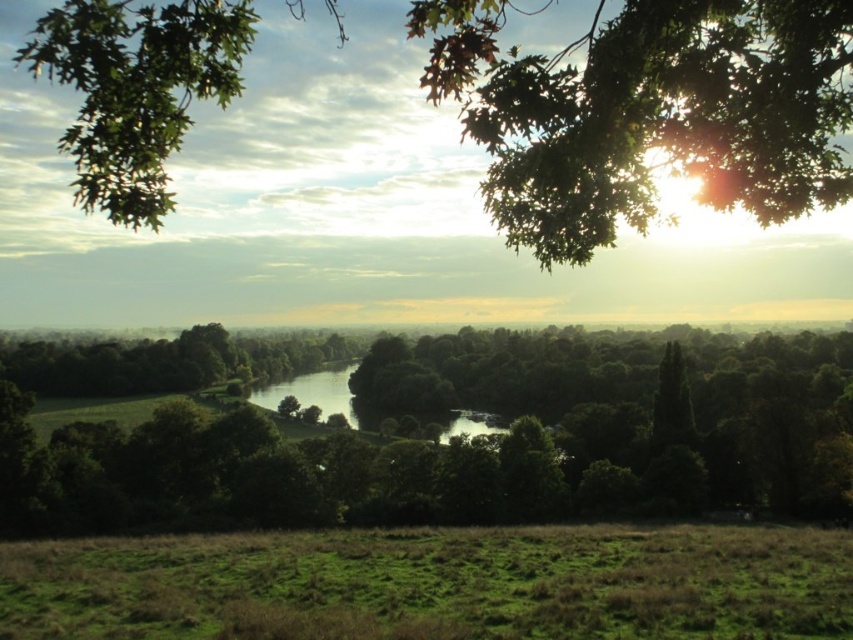
Is green leafy tree at upper center positioned before green grassy field at lower center?

Yes, it is in front of green grassy field at lower center.

Is green leafy tree at upper center bigger than green grassy field at lower center?

Yes, green leafy tree at upper center is bigger than green grassy field at lower center.

Who is more forward, (x=840, y=108) or (x=640, y=628)?

Point (x=840, y=108) is in front.

The height and width of the screenshot is (640, 853). In order to click on green leafy tree at upper center in this screenshot , I will do `click(647, 113)`.

Between point (613, 349) and point (698, 624), which one is positioned in front?

Point (698, 624) is in front.

Is point (247, 461) positioned before point (820, 589)?

No.

Is point (73, 513) less distant than point (454, 573)?

No, it is behind (454, 573).

You are a GUI agent. You are given a task and a screenshot of the screen. Output one action in this format:
    pyautogui.click(x=<x>, y=<y>)
    Task: Click on the green leafy tree at center
    Image resolution: width=853 pixels, height=640 pixels.
    Given the screenshot: What is the action you would take?
    pyautogui.click(x=457, y=438)

Which is behind, point (408, 394) or point (236, 74)?

Point (408, 394)

Can you confirm if green leafy tree at center is smaller than green leafy tree at upper center?

Yes.

Which is in front, point (751, 368) or point (560, 65)?

Point (560, 65)

Where is `green leafy tree at center`? This screenshot has height=640, width=853. green leafy tree at center is located at coordinates (457, 438).